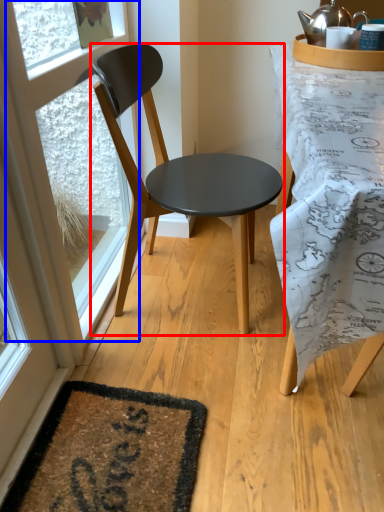
Question: Which point is closer to the camera, chair (highlighted by a red box) or window frame (highlighted by a blue box)?

Choices:
 (A) chair
 (B) window frame

Answer: (A)